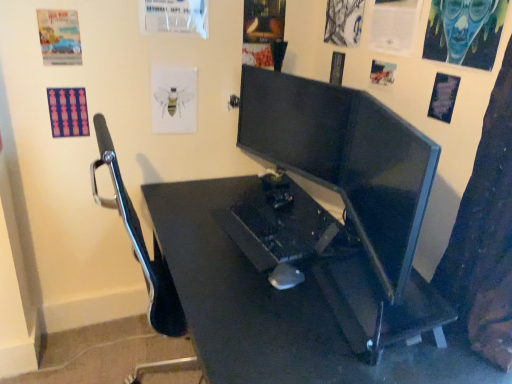
Question: Is matte paper poster at upper left, the second poster page viewed from the left, thinner than white paper bee at upper center, the 3th poster page from the left?

Choices:
 (A) no
 (B) yes

Answer: (B)

Question: From a real-world perspective, does matte paper poster at upper left, which is counted as the 8th poster page, starting from the right, sit lower than white paper bee at upper center, the 3th poster page from the left?

Choices:
 (A) no
 (B) yes

Answer: (A)

Question: Are matte paper poster at upper left, which is counted as the 8th poster page, starting from the right, and white paper bee at upper center, the 3th poster page from the left, located far from each other?

Choices:
 (A) yes
 (B) no

Answer: (B)

Question: Is matte paper poster at upper left, the second poster page viewed from the left, aimed at white paper bee at upper center, which is the seventh poster page in right-to-left order?

Choices:
 (A) yes
 (B) no

Answer: (B)

Question: Can you confirm if matte paper poster at upper left, which is counted as the 8th poster page, starting from the right, is shorter than white paper bee at upper center, which is the seventh poster page in right-to-left order?

Choices:
 (A) yes
 (B) no

Answer: (A)

Question: Is matte paper poster at upper left, which is counted as the 8th poster page, starting from the right, beside white paper bee at upper center, the 3th poster page from the left?

Choices:
 (A) no
 (B) yes

Answer: (A)

Question: Is blue painted canvas at upper right, placed as the ninth poster page when sorted from left to right, at the right side of matte paper poster at upper right, arranged as the 6th poster page when viewed from the left?

Choices:
 (A) no
 (B) yes

Answer: (B)

Question: Is blue painted canvas at upper right, placed as the ninth poster page when sorted from left to right, shorter than matte paper poster at upper right, the fourth poster page when ordered from right to left?

Choices:
 (A) yes
 (B) no

Answer: (B)

Question: From the image's perspective, is blue painted canvas at upper right, placed as the ninth poster page when sorted from left to right, below matte paper poster at upper right, arranged as the 6th poster page when viewed from the left?

Choices:
 (A) no
 (B) yes

Answer: (A)

Question: Considering the relative sizes of blue painted canvas at upper right, placed as the ninth poster page when sorted from left to right, and matte paper poster at upper right, the fourth poster page when ordered from right to left, in the image provided, is blue painted canvas at upper right, placed as the ninth poster page when sorted from left to right, wider than matte paper poster at upper right, the fourth poster page when ordered from right to left,?

Choices:
 (A) yes
 (B) no

Answer: (A)

Question: Is blue painted canvas at upper right, which is the 1th poster page from right to left, facing towards matte paper poster at upper right, the fourth poster page when ordered from right to left?

Choices:
 (A) no
 (B) yes

Answer: (A)

Question: Is blue painted canvas at upper right, placed as the ninth poster page when sorted from left to right, oriented away from matte paper poster at upper right, arranged as the 6th poster page when viewed from the left?

Choices:
 (A) yes
 (B) no

Answer: (B)

Question: From the image's perspective, is black plastic desk at center on black plastic mouse at center?

Choices:
 (A) no
 (B) yes

Answer: (A)